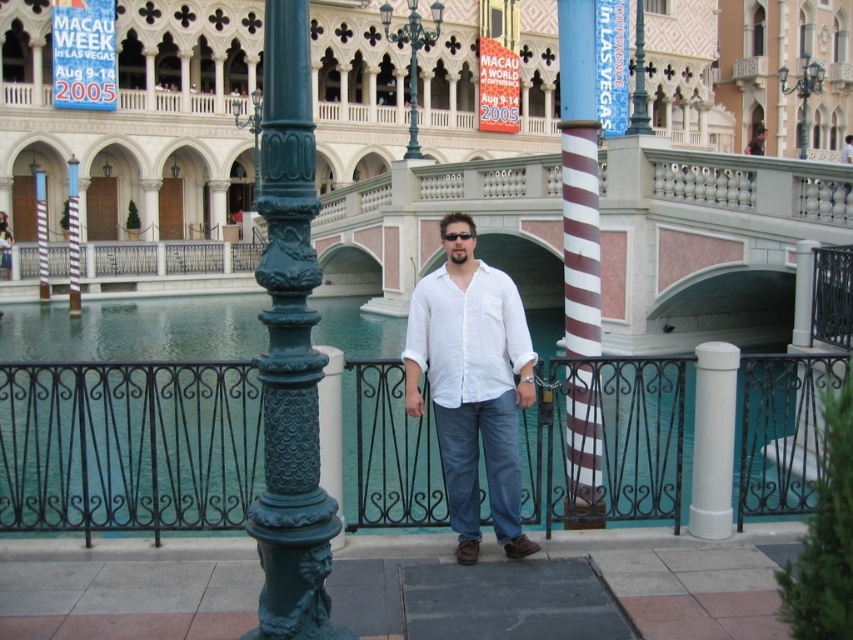
You are a photographer trying to capture the man in the white cotton shirt at center. The black wrought iron fence at center is blocking part of your view. Can you adjust your angle to avoid the fence?

The black wrought iron fence at center is located below the white cotton shirt at center, so you can lower your camera angle to capture the shirt without the fence obstructing the view.

Based on the photo, you are standing at the point labeled point (x=73, y=237) on striped wood pole at center. Which direction would you face to look towards the black wrought iron railing?

The point (x=73, y=237) is on striped wood pole at center. Since the man is leaning against a black wrought iron railing that separates him from the canal, facing towards the railing would mean turning towards the canal side. Therefore, facing the direction of the black wrought iron railing from the striped wood pole at center would involve looking towards the canal area where the railing is located.